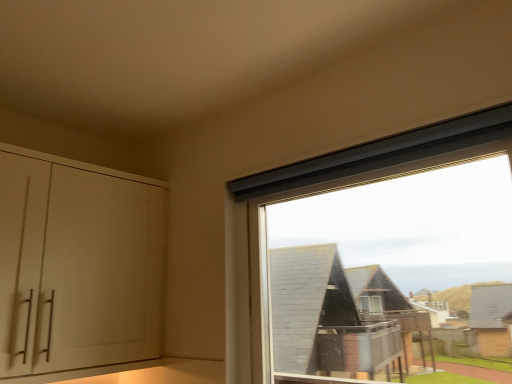
This screenshot has height=384, width=512. In order to click on white matte cabinet at left in this screenshot , I will do `click(77, 268)`.

Measure the distance between point (10, 327) and camera.

Point (10, 327) is 1.33 meters from camera.

This screenshot has height=384, width=512. Describe the element at coordinates (77, 268) in the screenshot. I see `white matte cabinet at left` at that location.

What do you see at coordinates (335, 190) in the screenshot?
I see `transparent glass window at upper right` at bounding box center [335, 190].

The height and width of the screenshot is (384, 512). Find the location of `transparent glass window at upper right`. transparent glass window at upper right is located at coordinates (335, 190).

Image resolution: width=512 pixels, height=384 pixels. In order to click on white matte cabinet at left in this screenshot , I will do `click(77, 268)`.

Considering the positions of objects transparent glass window at upper right and white matte cabinet at left in the image provided, who is more to the left, transparent glass window at upper right or white matte cabinet at left?

white matte cabinet at left is more to the left.

Is transparent glass window at upper right in front of white matte cabinet at left?

Yes, transparent glass window at upper right is closer to the camera.

Is point (466, 138) less distant than point (129, 262)?

Yes, point (466, 138) is closer to viewer.

From the image's perspective, is transparent glass window at upper right located above or below white matte cabinet at left?

Clearly, from the image's perspective, transparent glass window at upper right is above white matte cabinet at left.

From a real-world perspective, is transparent glass window at upper right on white matte cabinet at left?

No, from a real-world perspective, transparent glass window at upper right is not above white matte cabinet at left.

Considering the sizes of objects transparent glass window at upper right and white matte cabinet at left in the image provided, who is thinner, transparent glass window at upper right or white matte cabinet at left?

transparent glass window at upper right is thinner.

Does transparent glass window at upper right have a greater height compared to white matte cabinet at left?

No, transparent glass window at upper right is not taller than white matte cabinet at left.

Considering the sizes of objects transparent glass window at upper right and white matte cabinet at left in the image provided, who is smaller, transparent glass window at upper right or white matte cabinet at left?

transparent glass window at upper right.

Is transparent glass window at upper right not inside white matte cabinet at left?

Yes, transparent glass window at upper right is located beyond the bounds of white matte cabinet at left.

Are transparent glass window at upper right and white matte cabinet at left far apart?

That's not correct — transparent glass window at upper right is a little close to white matte cabinet at left.

Is white matte cabinet at left at the back of transparent glass window at upper right?

No, transparent glass window at upper right's orientation is not away from white matte cabinet at left.

This screenshot has width=512, height=384. Identify the location of window above the white matte cabinet at left (from the image's perspective). (335, 190).

Visually, is white matte cabinet at left positioned to the left or to the right of transparent glass window at upper right?

white matte cabinet at left is positioned on transparent glass window at upper right's left side.

Considering the positions of objects white matte cabinet at left and transparent glass window at upper right in the image provided, who is behind, white matte cabinet at left or transparent glass window at upper right?

white matte cabinet at left is more distant.

Considering the positions of points (152, 274) and (247, 224), is point (152, 274) closer to camera compared to point (247, 224)?

No, it is not.

Looking at this image, from the image's perspective, relative to transparent glass window at upper right, is white matte cabinet at left above or below?

Clearly, from the image's perspective, white matte cabinet at left is below transparent glass window at upper right.

In the scene shown: From a real-world perspective, which object rests below the other?

transparent glass window at upper right.

In terms of width, does white matte cabinet at left look wider or thinner when compared to transparent glass window at upper right?

In the image, white matte cabinet at left appears to be wider than transparent glass window at upper right.

Considering the relative sizes of white matte cabinet at left and transparent glass window at upper right in the image provided, is white matte cabinet at left shorter than transparent glass window at upper right?

No.

Which of these two, white matte cabinet at left or transparent glass window at upper right, is bigger?

With larger size is white matte cabinet at left.

Is white matte cabinet at left not inside transparent glass window at upper right?

Absolutely, white matte cabinet at left is external to transparent glass window at upper right.

Based on the photo, does white matte cabinet at left touch transparent glass window at upper right?

They are not placed beside each other.

Is white matte cabinet at left facing towards transparent glass window at upper right?

Yes, white matte cabinet at left faces towards transparent glass window at upper right.

What's the angular difference between white matte cabinet at left and transparent glass window at upper right's facing directions?

90.7 degrees separate the facing orientations of white matte cabinet at left and transparent glass window at upper right.

Locate an element on the screen. cabinetry that appears above the transparent glass window at upper right (from a real-world perspective) is located at coordinates (77, 268).

Identify the location of cabinetry on the left of transparent glass window at upper right. (77, 268).

Image resolution: width=512 pixels, height=384 pixels. I want to click on window located in front of the white matte cabinet at left, so click(335, 190).